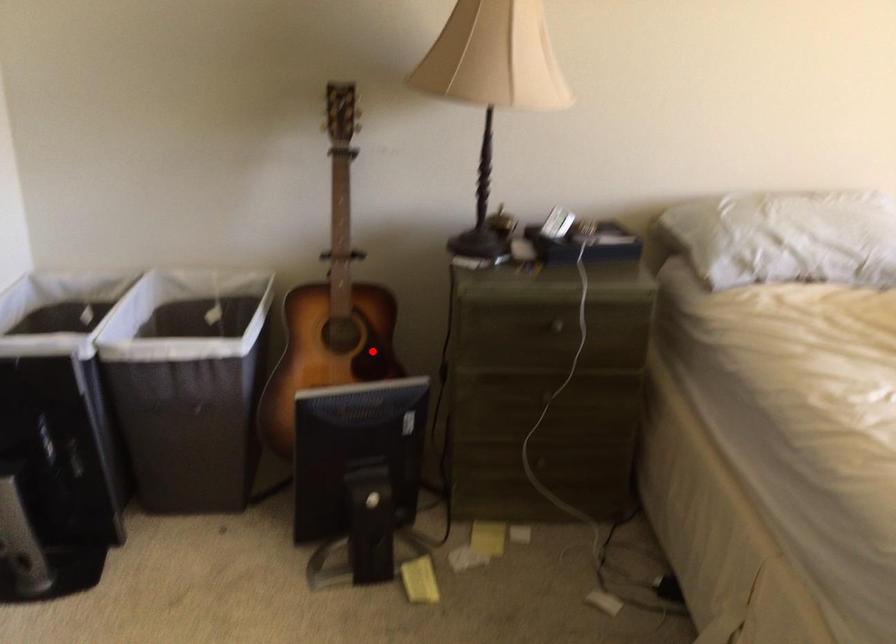
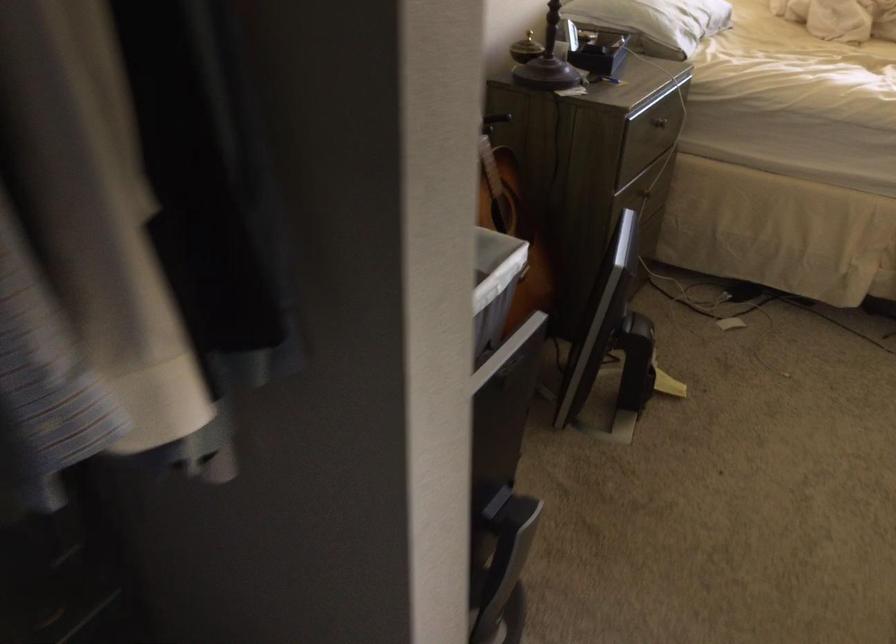
Question: I am providing you with two images of the same scene from different viewpoints. In image1, a red point is highlighted. Considering the same 3D point in image2, which of the following is correct?

Choices:
 (A) It is closer
 (B) It is farther

Answer: (A)